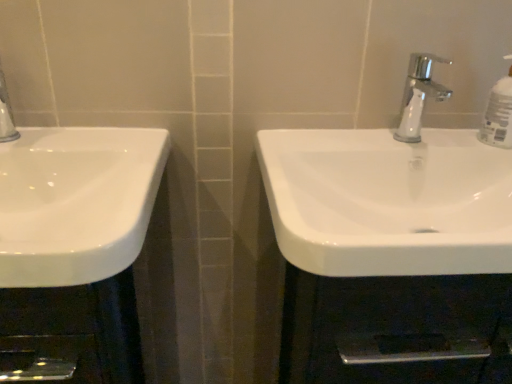
Question: From the image's perspective, does white glossy sink at center, which appears as the first sink when viewed from the right, appear lower than clear plastic bottle at upper right?

Choices:
 (A) yes
 (B) no

Answer: (A)

Question: From a real-world perspective, is white glossy sink at center, the 2th sink when ordered from left to right, beneath clear plastic bottle at upper right?

Choices:
 (A) no
 (B) yes

Answer: (B)

Question: Is white glossy sink at center, the 2th sink when ordered from left to right, beside clear plastic bottle at upper right?

Choices:
 (A) no
 (B) yes

Answer: (A)

Question: Is white glossy sink at center, which appears as the first sink when viewed from the right, at the right side of clear plastic bottle at upper right?

Choices:
 (A) no
 (B) yes

Answer: (A)

Question: From the image's perspective, is white glossy sink at center, the 2th sink when ordered from left to right, above clear plastic bottle at upper right?

Choices:
 (A) yes
 (B) no

Answer: (B)

Question: From the image's perspective, is white glossy sink at left, placed as the second sink when sorted from right to left, above or below white glossy sink at center, the 2th sink when ordered from left to right?

Choices:
 (A) above
 (B) below

Answer: (B)

Question: From a real-world perspective, is white glossy sink at left, placed as the second sink when sorted from right to left, above or below white glossy sink at center, the 2th sink when ordered from left to right?

Choices:
 (A) below
 (B) above

Answer: (B)

Question: In terms of size, does white glossy sink at left, which is the first sink in left-to-right order, appear bigger or smaller than white glossy sink at center, which appears as the first sink when viewed from the right?

Choices:
 (A) small
 (B) big

Answer: (A)

Question: Is white glossy sink at left, placed as the second sink when sorted from right to left, inside the boundaries of white glossy sink at center, the 2th sink when ordered from left to right, or outside?

Choices:
 (A) outside
 (B) inside

Answer: (A)

Question: In terms of height, does chrome metallic faucet at upper center look taller or shorter compared to clear plastic bottle at upper right?

Choices:
 (A) short
 (B) tall

Answer: (A)

Question: Relative to clear plastic bottle at upper right, is chrome metallic faucet at upper center in front or behind?

Choices:
 (A) front
 (B) behind

Answer: (A)

Question: From the image's perspective, is chrome metallic faucet at upper center above or below clear plastic bottle at upper right?

Choices:
 (A) below
 (B) above

Answer: (A)

Question: In the image, is chrome metallic faucet at upper center on the left side or the right side of clear plastic bottle at upper right?

Choices:
 (A) right
 (B) left

Answer: (B)

Question: From the image's perspective, is clear plastic bottle at upper right located above or below chrome metallic faucet at upper center?

Choices:
 (A) below
 (B) above

Answer: (B)

Question: From a real-world perspective, relative to chrome metallic faucet at upper center, is clear plastic bottle at upper right vertically above or below?

Choices:
 (A) below
 (B) above

Answer: (B)